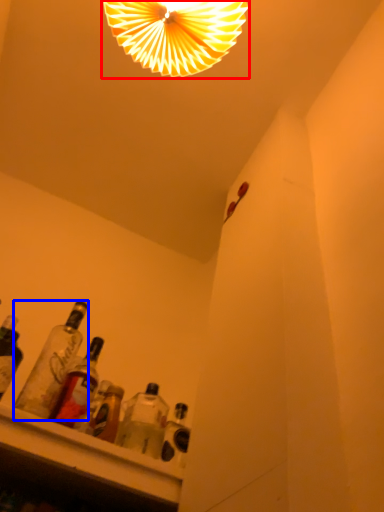
Question: Which point is further to the camera, lamp (highlighted by a red box) or bottle (highlighted by a blue box)?

Choices:
 (A) lamp
 (B) bottle

Answer: (A)